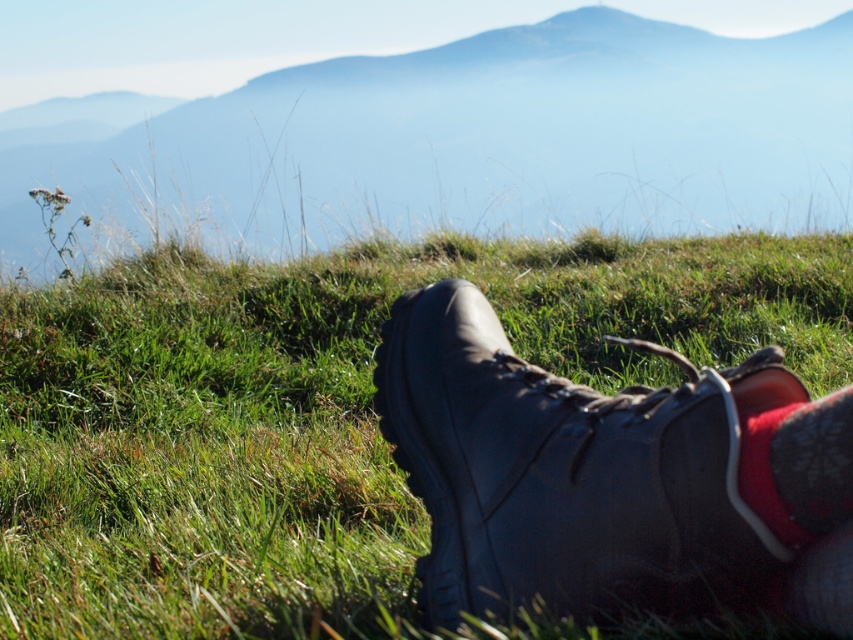
Question: Observing the image, what is the correct spatial positioning of leather boot at lower center in reference to red suede sock at lower right?

Choices:
 (A) right
 (B) left

Answer: (B)

Question: Based on their relative distances, which object is farther from the red suede sock at lower right?

Choices:
 (A) leather boot at lower center
 (B) green grass at lower center

Answer: (B)

Question: Which of the following is the closest to the observer?

Choices:
 (A) green grass at lower center
 (B) red suede sock at lower right
 (C) green grass at lower left

Answer: (B)

Question: Does green grass at lower center have a lesser width compared to green grass at lower left?

Choices:
 (A) no
 (B) yes

Answer: (B)

Question: Based on their relative distances, which object is nearer to the green grass at lower center?

Choices:
 (A) green grass at lower left
 (B) leather boot at lower center

Answer: (B)

Question: Can you confirm if green grass at lower left is positioned to the left of leather boot at lower center?

Choices:
 (A) yes
 (B) no

Answer: (B)